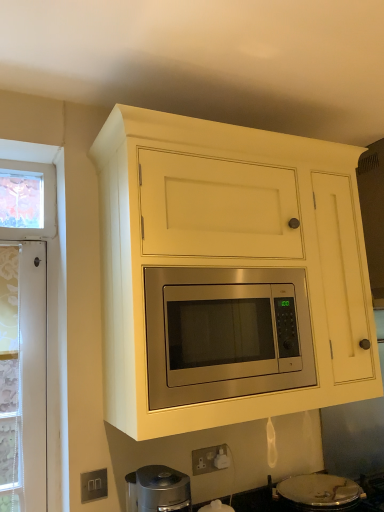
Question: Is point (167, 342) closer or farther from the camera than point (296, 509)?

Choices:
 (A) farther
 (B) closer

Answer: (B)

Question: Is matte yellow cabinet at center to the left or to the right of silver metallic gas stove at lower center in the image?

Choices:
 (A) left
 (B) right

Answer: (A)

Question: Based on their relative distances, which object is farther from the satin silver outlet at lower left?

Choices:
 (A) silver metallic gas stove at lower center
 (B) stainless steel microwave at center
 (C) matte yellow cabinet at center

Answer: (C)

Question: Which object is positioned closest to the satin silver outlet at lower left?

Choices:
 (A) matte yellow cabinet at center
 (B) silver metallic gas stove at lower center
 (C) stainless steel microwave at center

Answer: (C)